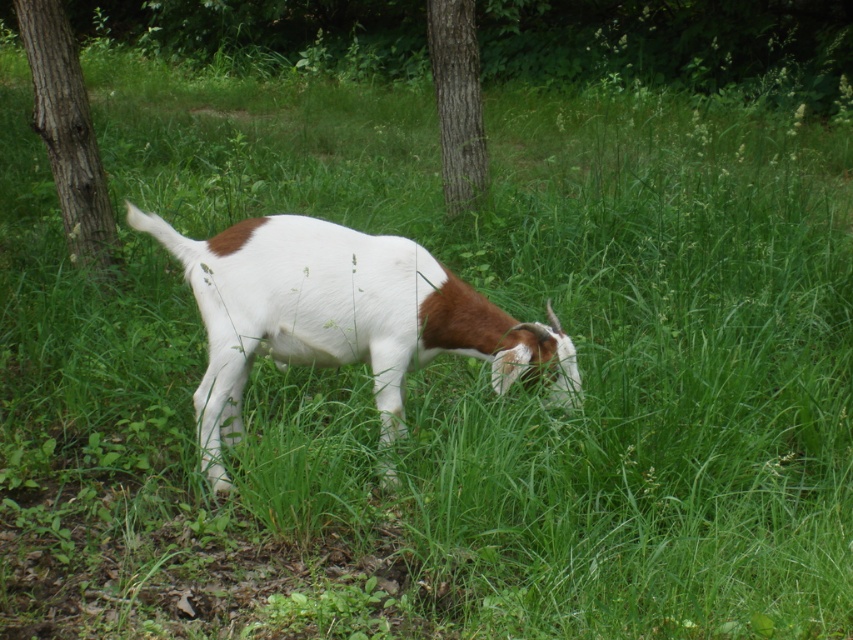
Does white soft fur goat at center have a greater height compared to brown rough bark at left?

No.

Who is more forward, (546, 353) or (90, 248)?

Point (546, 353)

Identify the location of white soft fur goat at center. The height and width of the screenshot is (640, 853). (341, 317).

In the scene shown: Does white soft fur goat at center have a smaller size compared to brown rough bark tree at center?

No, white soft fur goat at center is not smaller than brown rough bark tree at center.

Is point (352, 314) in front of point (461, 186)?

Yes.

Between point (287, 250) and point (480, 140), which one is positioned behind?

Positioned behind is point (480, 140).

Identify the location of white soft fur goat at center. The image size is (853, 640). (341, 317).

Which of these two, brown rough bark at left or brown rough bark tree at center, stands shorter?

brown rough bark tree at center is shorter.

Is the position of brown rough bark at left more distant than that of brown rough bark tree at center?

No, brown rough bark at left is in front of brown rough bark tree at center.

Who is more forward, (77, 198) or (480, 132)?

Point (77, 198) is in front.

Find the location of `brown rough bark at left`. brown rough bark at left is located at coordinates (67, 131).